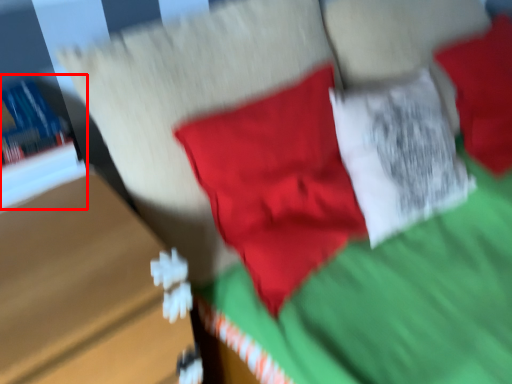
Question: From the image's perspective, considering the relative positions of book (annotated by the red box) and table in the image provided, where is book (annotated by the red box) located with respect to the staircase?

Choices:
 (A) above
 (B) below

Answer: (A)